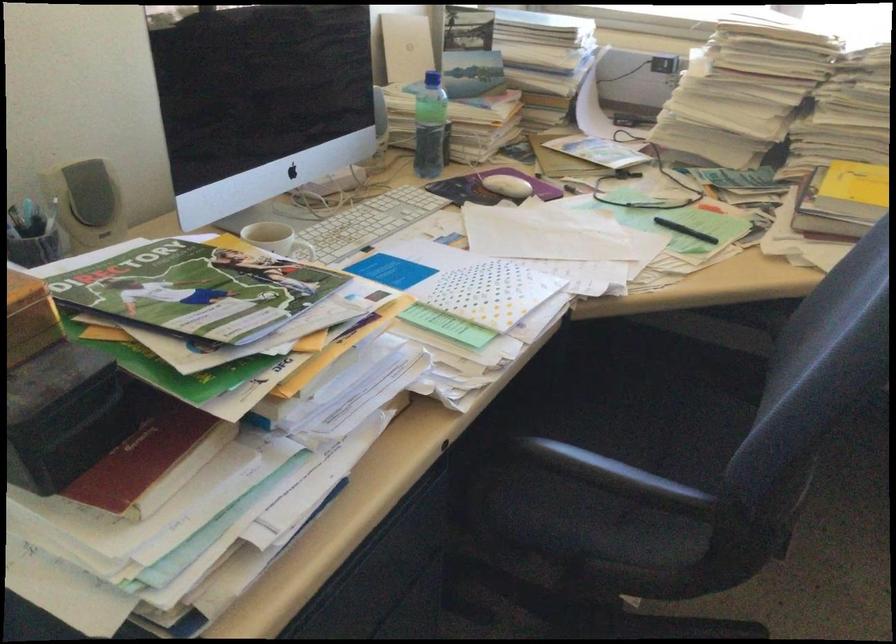
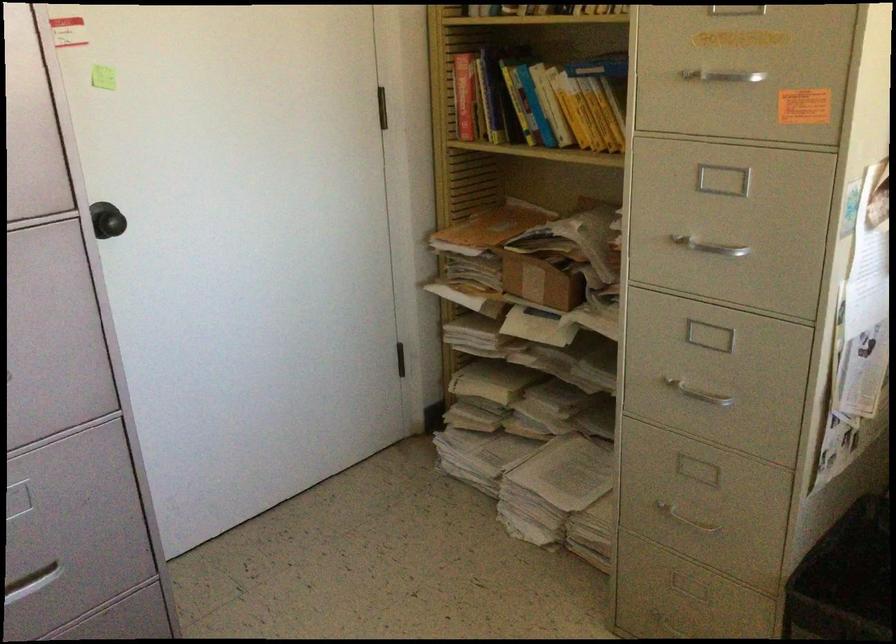
How did the camera likely rotate?

The camera rotated toward left-down.